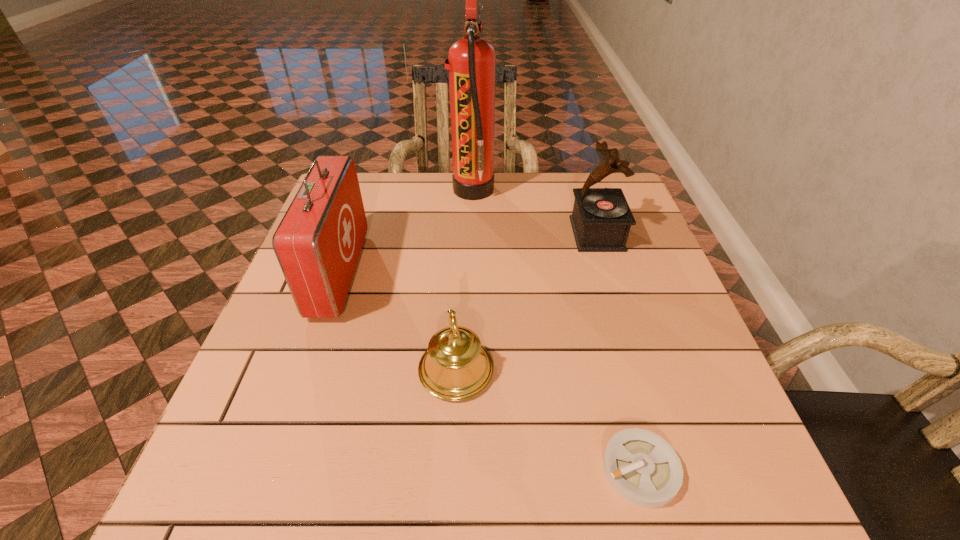
This screenshot has height=540, width=960. I want to click on ashtray present at the right edge, so click(644, 469).

Where is `object located in the far right corner section of the desktop`? object located in the far right corner section of the desktop is located at coordinates (601, 219).

What are the coordinates of `object at the near right corner` in the screenshot? It's located at (644, 469).

At what (x,y) coordinates should I click in order to perform the action: click on free space at the far edge. Please return your answer as a coordinate pair (x, y). Looking at the image, I should click on (501, 194).

Where is `vacant space at the near edge of the desktop`? vacant space at the near edge of the desktop is located at coordinates (311, 478).

In the image, there is a desktop. Where is `vacant space at the right edge`? vacant space at the right edge is located at coordinates (644, 421).

In the image, there is a desktop. Find the location of `blank space at the far left corner`. blank space at the far left corner is located at coordinates (369, 209).

In order to click on unoccupied area between the nearest object and the fourth tallest object in this screenshot , I will do `click(548, 420)`.

The width and height of the screenshot is (960, 540). In order to click on free space between the shortest object and the phonograph_record in this screenshot , I will do (x=618, y=352).

This screenshot has height=540, width=960. What are the coordinates of `vacant area that lies between the fire extinguisher and the ashtray` in the screenshot? It's located at (557, 329).